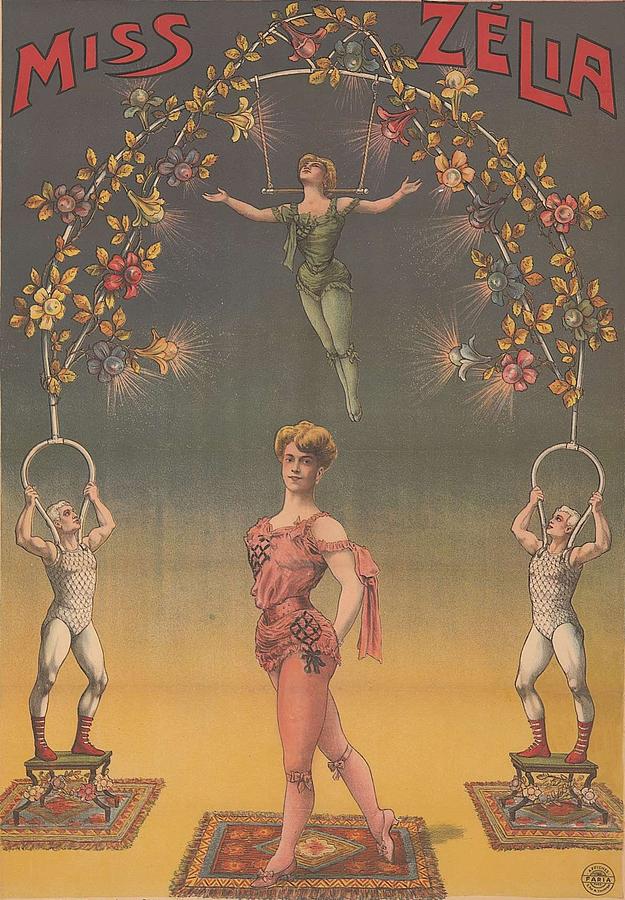
You are a GUI agent. You are given a task and a screenshot of the screen. Output one action in this format:
    pyautogui.click(x=<x>, y=<y>)
    Task: Click on the stool
    The width and height of the screenshot is (625, 900).
    Given the screenshot: What is the action you would take?
    pyautogui.click(x=550, y=760), pyautogui.click(x=74, y=765)